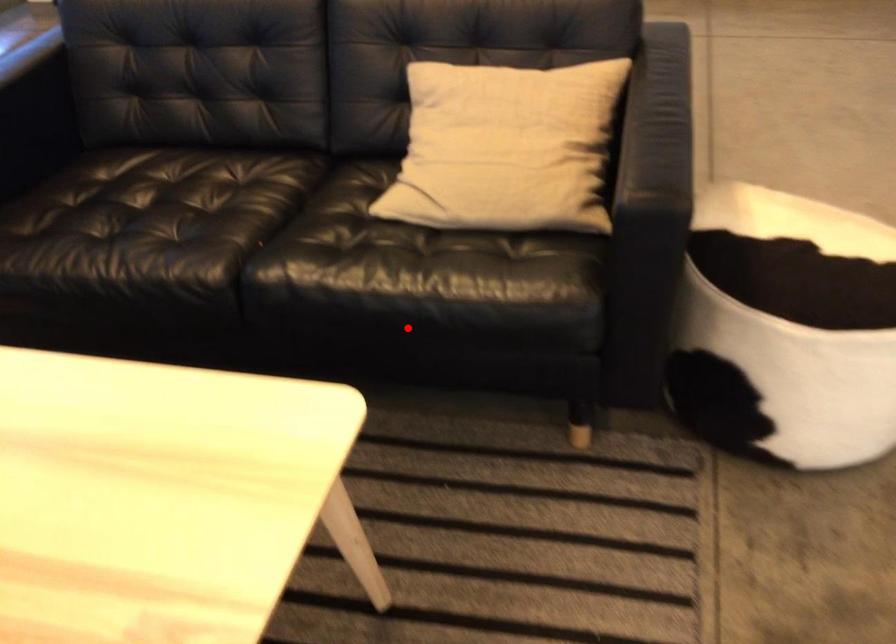
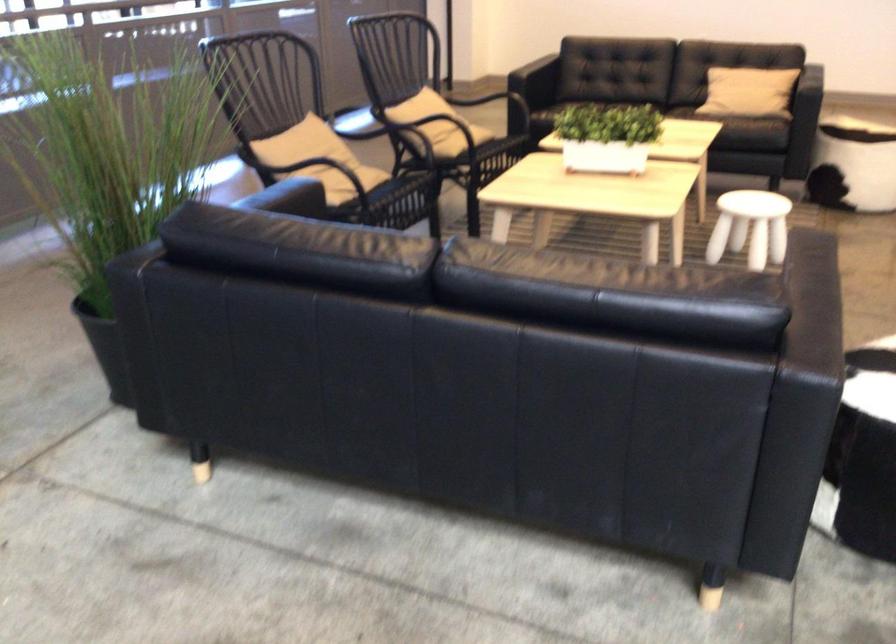
Where in the second image is the point corresponding to the highlighted location from the first image?

(745, 120)